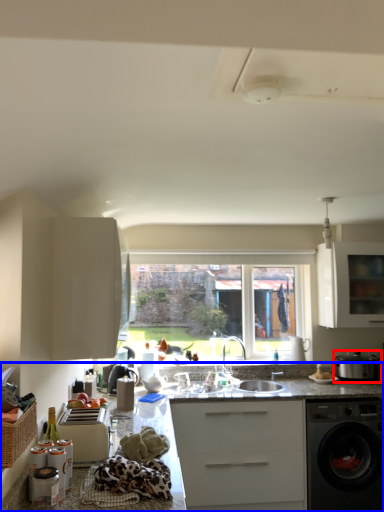
Question: Among these objects, which one is farthest to the camera, kitchen appliance (highlighted by a red box) or countertop (highlighted by a blue box)?

Choices:
 (A) kitchen appliance
 (B) countertop

Answer: (A)